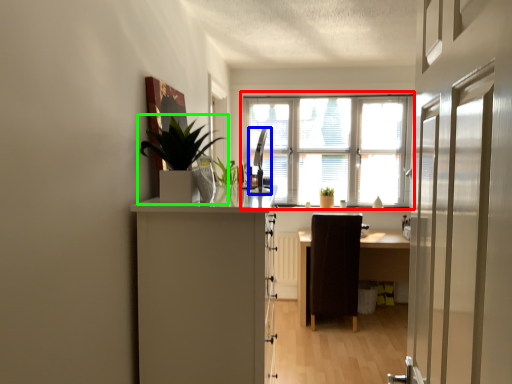
Question: Based on their relative distances, which object is farther from window (highlighted by a red box)? Choose from silver (highlighted by a blue box) and houseplant (highlighted by a green box).

Choices:
 (A) silver
 (B) houseplant

Answer: (B)